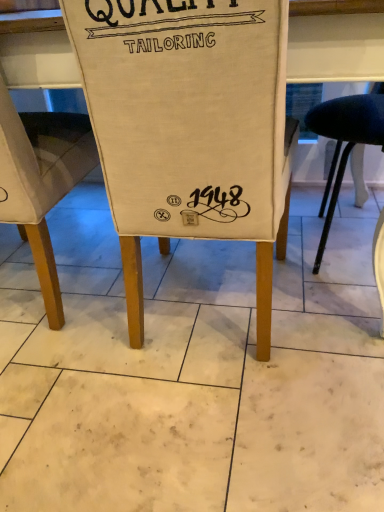
Question: Considering the positions of point click(46, 249) and point click(178, 169), is point click(46, 249) closer or farther from the camera than point click(178, 169)?

Choices:
 (A) farther
 (B) closer

Answer: (A)

Question: In the image, is canvas chair at lower left, the 2th chair viewed from the right, on the left side or the right side of canvas bag at center, positioned as the 1th chair in right-to-left order?

Choices:
 (A) left
 (B) right

Answer: (A)

Question: Considering the positions of canvas chair at lower left, the 2th chair viewed from the right, and canvas bag at center, which appears as the second chair when viewed from the left, in the image, is canvas chair at lower left, the 2th chair viewed from the right, bigger or smaller than canvas bag at center, which appears as the second chair when viewed from the left,?

Choices:
 (A) small
 (B) big

Answer: (A)

Question: Which is correct: canvas bag at center, which appears as the second chair when viewed from the left, is inside canvas chair at lower left, acting as the 1th chair starting from the left, or outside of it?

Choices:
 (A) outside
 (B) inside

Answer: (A)

Question: From the image's perspective, is canvas bag at center, which appears as the second chair when viewed from the left, located above or below canvas chair at lower left, acting as the 1th chair starting from the left?

Choices:
 (A) below
 (B) above

Answer: (A)

Question: Considering the positions of canvas bag at center, which appears as the second chair when viewed from the left, and canvas chair at lower left, acting as the 1th chair starting from the left, in the image, is canvas bag at center, which appears as the second chair when viewed from the left, bigger or smaller than canvas chair at lower left, acting as the 1th chair starting from the left,?

Choices:
 (A) small
 (B) big

Answer: (B)

Question: From a real-world perspective, is canvas bag at center, positioned as the 1th chair in right-to-left order, physically located above or below canvas chair at lower left, the 2th chair viewed from the right?

Choices:
 (A) above
 (B) below

Answer: (A)